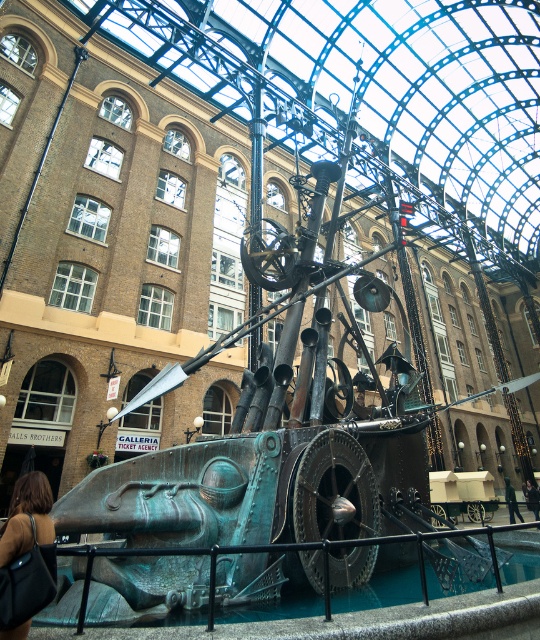
Which of these two, green fabric jacket at lower right or dark brown leather jacket at lower center, stands shorter?

dark brown leather jacket at lower center is shorter.

Which is behind, point (505, 493) or point (526, 500)?

Positioned behind is point (526, 500).

You are a GUI agent. You are given a task and a screenshot of the screen. Output one action in this format:
    pyautogui.click(x=<x>, y=<y>)
    Task: Click on the green fabric jacket at lower right
    The image size is (540, 640).
    Given the screenshot: What is the action you would take?
    pyautogui.click(x=511, y=500)

Looking at this image, is brown leather bag at lower left closer to camera compared to dark brown leather jacket at lower center?

Yes, brown leather bag at lower left is closer to the viewer.

Does brown leather bag at lower left have a lesser height compared to dark brown leather jacket at lower center?

Yes, brown leather bag at lower left is shorter than dark brown leather jacket at lower center.

Which is in front, point (29, 472) or point (529, 490)?

Point (29, 472) is more forward.

This screenshot has height=640, width=540. Identify the location of brown leather bag at lower left. (27, 556).

This screenshot has height=640, width=540. Describe the element at coordinates (27, 556) in the screenshot. I see `brown leather bag at lower left` at that location.

This screenshot has width=540, height=640. Identify the location of brown leather bag at lower left. pos(27,556).

Where is `brown leather bag at lower left`? This screenshot has height=640, width=540. brown leather bag at lower left is located at coordinates (27, 556).